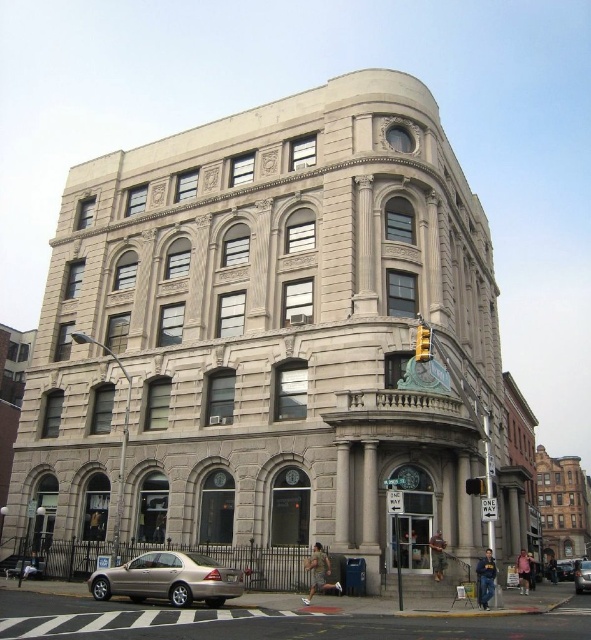
Who is higher up, gold metallic sedan at lower left or yellow matte traffic light at upper center?

yellow matte traffic light at upper center is above.

Between gold metallic sedan at lower left and yellow matte traffic light at upper center, which one appears on the right side from the viewer's perspective?

From the viewer's perspective, yellow matte traffic light at upper center appears more on the right side.

Which is behind, point (163, 554) or point (482, 477)?

Point (482, 477)

At what (x,y) coordinates should I click in order to perform the action: click on gold metallic sedan at lower left. Please return your answer as a coordinate pair (x, y). The image size is (591, 640). Looking at the image, I should click on (x=168, y=579).

Is yellow plastic traffic light at upper center further to camera compared to yellow matte traffic light at upper center?

That is True.

Image resolution: width=591 pixels, height=640 pixels. Describe the element at coordinates (423, 342) in the screenshot. I see `yellow plastic traffic light at upper center` at that location.

Image resolution: width=591 pixels, height=640 pixels. I want to click on yellow plastic traffic light at upper center, so click(423, 342).

Who is taller, gold metallic sedan at lower right or yellow matte traffic light at upper center?

With more height is gold metallic sedan at lower right.

Which is in front, point (589, 561) or point (476, 490)?

Point (476, 490)

This screenshot has width=591, height=640. In order to click on gold metallic sedan at lower right in this screenshot , I will do `click(582, 576)`.